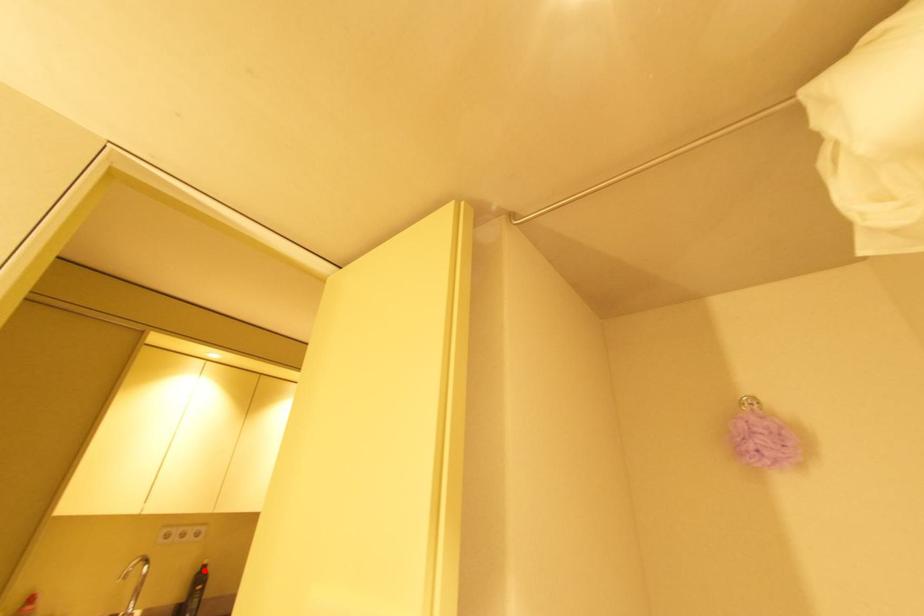
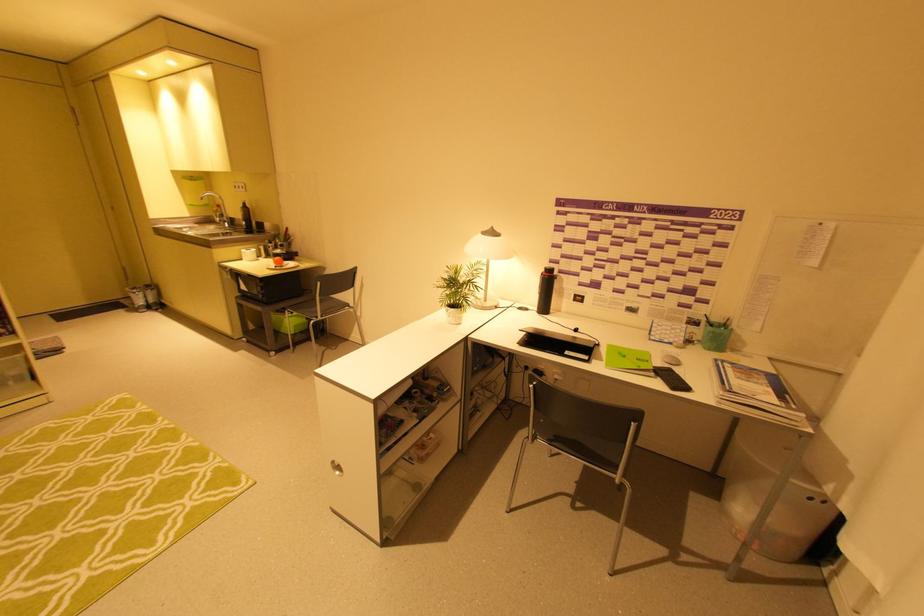
Find the pixel in the second image that matches the highlighted location in the first image.

(246, 206)